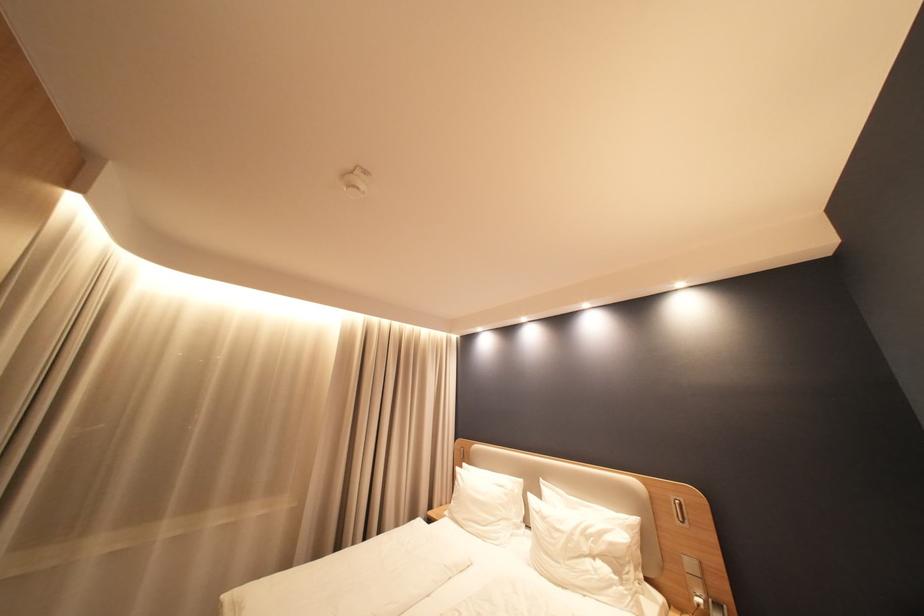
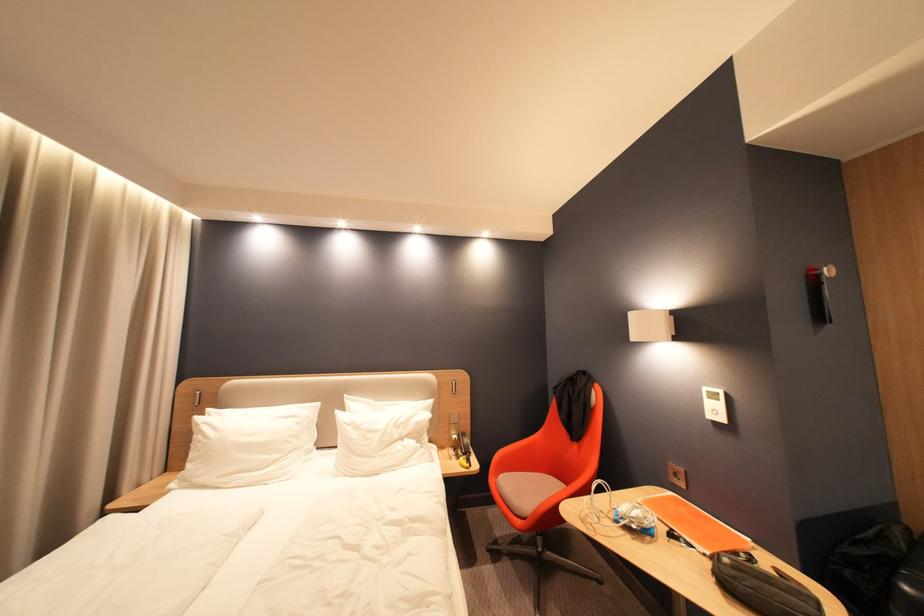
Question: I am providing you with two images of the same scene from different viewpoints. Which of the following objects are not visible in image2?

Choices:
 (A) white control panel
 (B) orange folder
 (C) white pillow
 (D) none of these

Answer: (D)